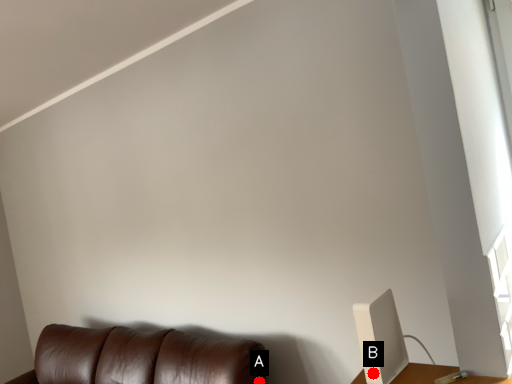
Question: Two points are circled on the image, labeled by A and B beside each circle. Which of the following is the closest to the observer?

Choices:
 (A) A is closer
 (B) B is closer

Answer: (B)